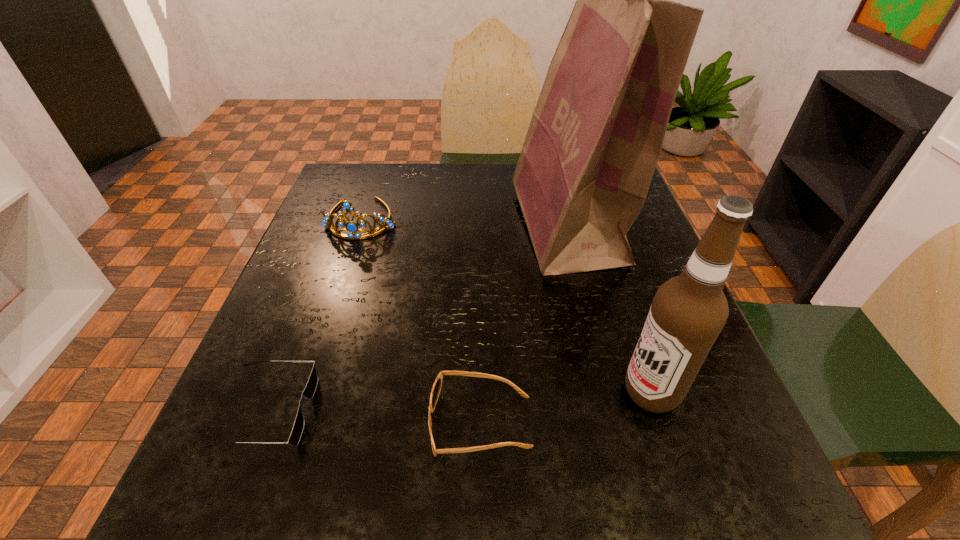
At what (x,y) coordinates should I click in order to perform the action: click on vacant space located on the label of the fourth shortest object. Please return your answer as a coordinate pair (x, y). The width and height of the screenshot is (960, 540). Looking at the image, I should click on (388, 392).

Where is `vacant space located 0.370m on the label of the fourth shortest object`? The height and width of the screenshot is (540, 960). vacant space located 0.370m on the label of the fourth shortest object is located at coordinates (399, 392).

I want to click on free region located 0.400m on the label of the fourth shortest object, so click(382, 392).

This screenshot has width=960, height=540. I want to click on free region located 0.310m on the front-facing side of the third shortest object, so click(x=319, y=348).

Identify the location of free point located on the front-facing side of the right sunglasses. The width and height of the screenshot is (960, 540). (297, 423).

Locate an element on the screen. free space located 0.160m on the front-facing side of the right sunglasses is located at coordinates (328, 423).

Find the location of a particular element. This screenshot has height=540, width=960. vacant point located 0.060m on the front-facing side of the right sunglasses is located at coordinates (393, 423).

Find the location of `free space located 0.140m on the front-facing side of the shorter sunglasses`. free space located 0.140m on the front-facing side of the shorter sunglasses is located at coordinates (397, 411).

At what (x,y) coordinates should I click in order to perform the action: click on grocery bag positioned at the far edge. Please return your answer as a coordinate pair (x, y). Looking at the image, I should click on (593, 143).

Where is `tiara situated at the far edge`? The width and height of the screenshot is (960, 540). tiara situated at the far edge is located at coordinates (351, 227).